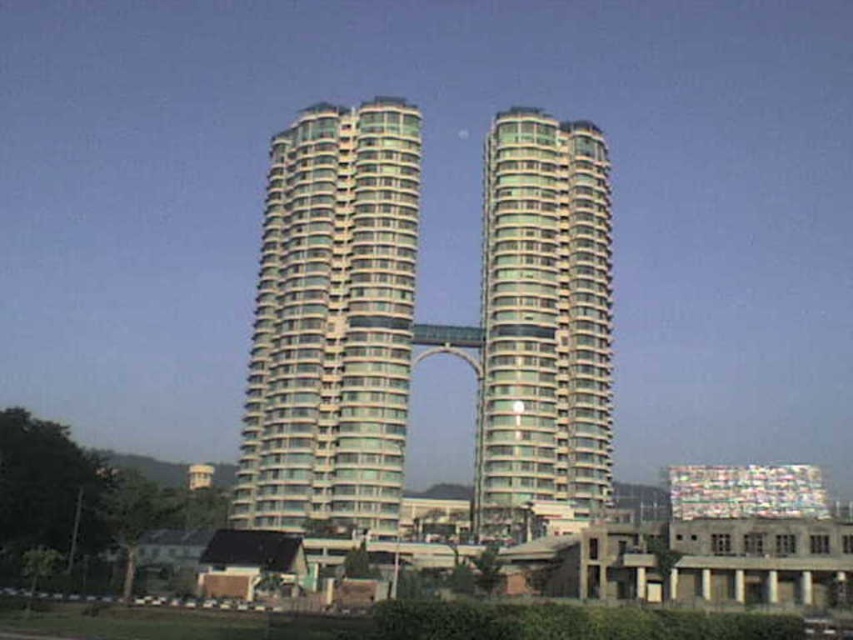
Question: Is glassy teal skyscraper at center positioned before glassy green tower at center?

Choices:
 (A) no
 (B) yes

Answer: (B)

Question: Which of the following is the closest to the observer?

Choices:
 (A) (361, 136)
 (B) (532, 321)

Answer: (B)

Question: Can you confirm if glassy teal skyscraper at center is bigger than glassy green tower at center?

Choices:
 (A) yes
 (B) no

Answer: (A)

Question: Among these points, which one is farthest from the camera?

Choices:
 (A) (361, 410)
 (B) (498, 483)

Answer: (A)

Question: Does glassy teal skyscraper at center appear on the right side of glassy green tower at center?

Choices:
 (A) yes
 (B) no

Answer: (B)